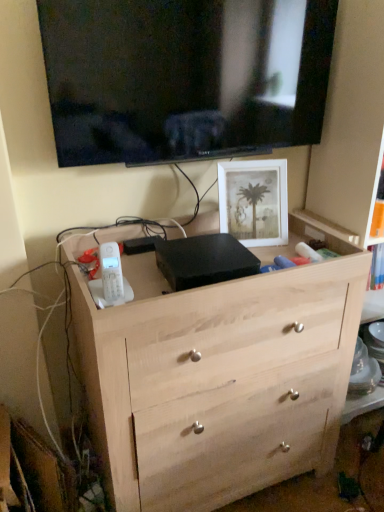
Question: Looking at their shapes, would you say black glossy tv at upper center is wider or thinner than natural wood chest of drawers at center?

Choices:
 (A) wide
 (B) thin

Answer: (B)

Question: Is black glossy tv at upper center inside the boundaries of natural wood chest of drawers at center, or outside?

Choices:
 (A) outside
 (B) inside

Answer: (A)

Question: Which object is the closest to the white matte picture frame at upper right?

Choices:
 (A) black glossy tv at upper center
 (B) natural wood chest of drawers at center

Answer: (A)

Question: Estimate the real-world distances between objects in this image. Which object is closer to the white matte picture frame at upper right?

Choices:
 (A) natural wood chest of drawers at center
 (B) black glossy tv at upper center

Answer: (B)